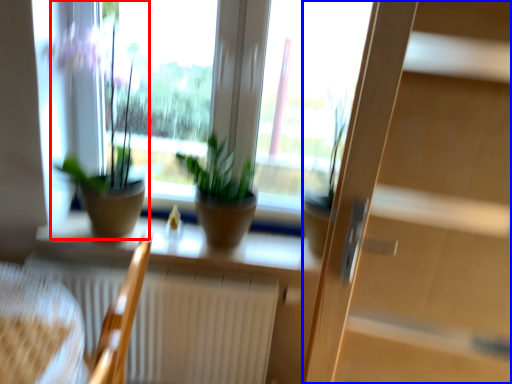
Question: Which object is further to the camera taking this photo, houseplant (highlighted by a red box) or screen door (highlighted by a blue box)?

Choices:
 (A) houseplant
 (B) screen door

Answer: (A)